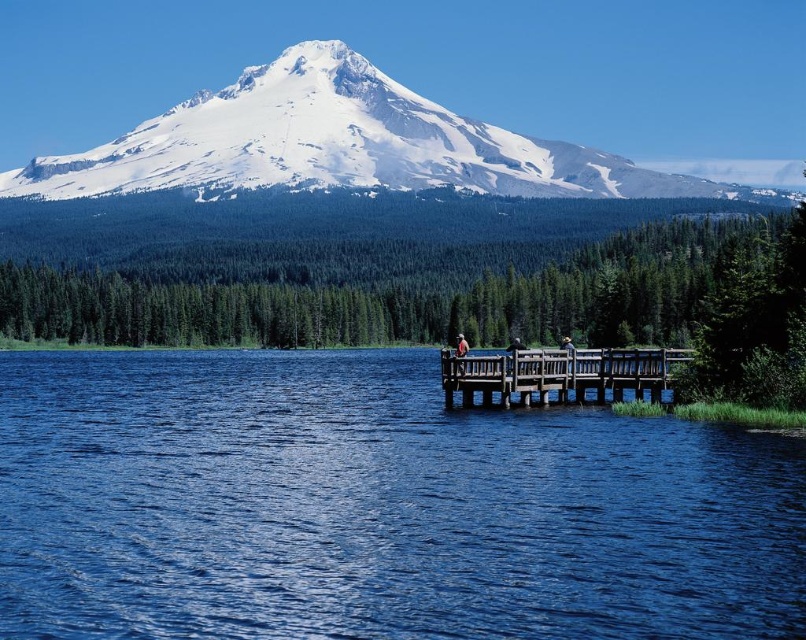
You are standing at the edge of the lake and see the wooden dock at center and the brown woven hat at center. Which object is closer to your right side?

The brown woven hat at center is closer to your right side because the wooden dock at center is to the left of it.